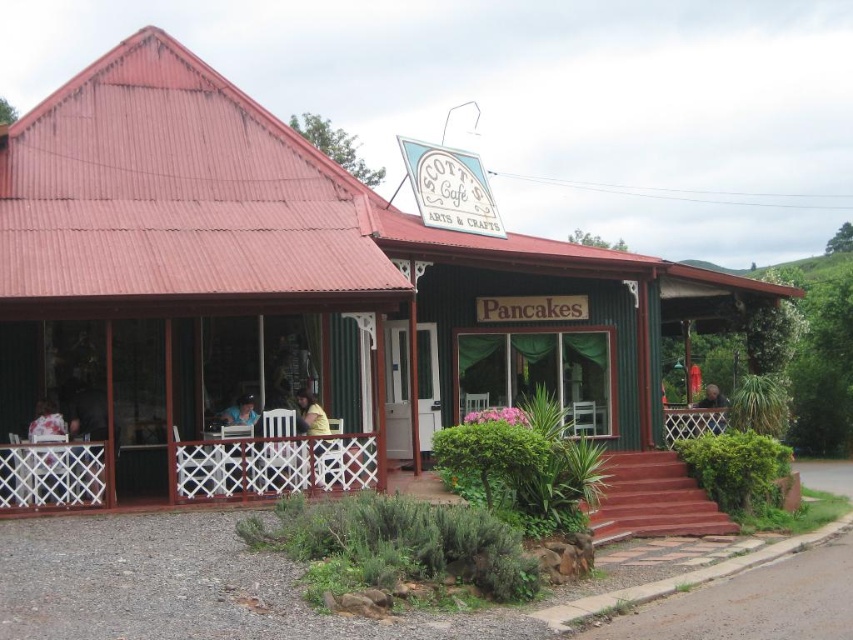
Question: Can you confirm if white lace tablecloth at lower left is smaller than matte white chair at center?

Choices:
 (A) no
 (B) yes

Answer: (A)

Question: Which of the following is the closest to the observer?

Choices:
 (A) wooden bench at right
 (B) white lace tablecloth at lower left

Answer: (B)

Question: Which of the following is the farthest from the observer?

Choices:
 (A) (235, 416)
 (B) (724, 404)
 (C) (648, 474)

Answer: (B)

Question: From the image, what is the correct spatial relationship of white lace tablecloth at lower left in relation to wooden bench at right?

Choices:
 (A) right
 (B) left

Answer: (B)

Question: Does white lace tablecloth at lower left have a larger size compared to matte white chair at center?

Choices:
 (A) no
 (B) yes

Answer: (B)

Question: Which point is closer to the camera?

Choices:
 (A) (405, 394)
 (B) (36, 433)
 (C) (323, 477)

Answer: (B)